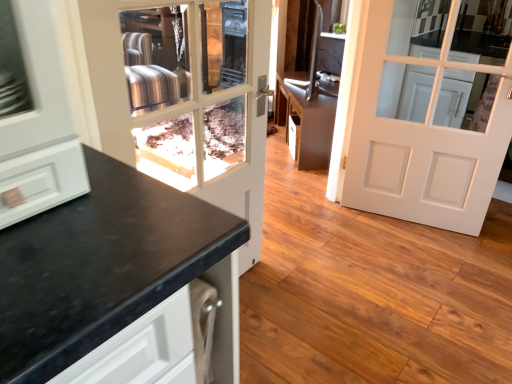
Question: Is brown matte cabinet at center to the right of white matte door at center, placed as the first door when sorted from right to left, from the viewer's perspective?

Choices:
 (A) yes
 (B) no

Answer: (B)

Question: Can we say brown matte cabinet at center lies outside white matte door at center, placed as the second door when sorted from left to right?

Choices:
 (A) yes
 (B) no

Answer: (A)

Question: From a real-world perspective, does brown matte cabinet at center sit lower than white matte door at center, placed as the first door when sorted from right to left?

Choices:
 (A) no
 (B) yes

Answer: (B)

Question: Is brown matte cabinet at center far away from white matte door at center, placed as the second door when sorted from left to right?

Choices:
 (A) yes
 (B) no

Answer: (B)

Question: Can you confirm if brown matte cabinet at center is wider than white matte door at center, placed as the first door when sorted from right to left?

Choices:
 (A) no
 (B) yes

Answer: (B)

Question: Considering the positions of matte black door at center, arranged as the first door when viewed from the left, and brown matte cabinet at center in the image, is matte black door at center, arranged as the first door when viewed from the left, taller or shorter than brown matte cabinet at center?

Choices:
 (A) tall
 (B) short

Answer: (A)

Question: Would you say matte black door at center, arranged as the first door when viewed from the left, is inside or outside brown matte cabinet at center?

Choices:
 (A) outside
 (B) inside

Answer: (A)

Question: Considering the positions of point (226, 79) and point (331, 102), is point (226, 79) closer or farther from the camera than point (331, 102)?

Choices:
 (A) farther
 (B) closer

Answer: (A)

Question: From a real-world perspective, is matte black door at center, arranged as the first door when viewed from the left, positioned above or below brown matte cabinet at center?

Choices:
 (A) above
 (B) below

Answer: (A)

Question: Is brown matte cabinet at center bigger or smaller than matte black door at center, marked as the second door in a right-to-left arrangement?

Choices:
 (A) small
 (B) big

Answer: (B)

Question: Does point (287, 84) appear closer or farther from the camera than point (176, 165)?

Choices:
 (A) farther
 (B) closer

Answer: (A)

Question: Visually, is brown matte cabinet at center positioned to the left or to the right of matte black door at center, arranged as the first door when viewed from the left?

Choices:
 (A) left
 (B) right

Answer: (B)

Question: Is brown matte cabinet at center wider or thinner than matte black door at center, marked as the second door in a right-to-left arrangement?

Choices:
 (A) wide
 (B) thin

Answer: (A)

Question: Is matte black door at center, arranged as the first door when viewed from the left, taller or shorter than white matte door at center, placed as the second door when sorted from left to right?

Choices:
 (A) short
 (B) tall

Answer: (B)

Question: Is matte black door at center, marked as the second door in a right-to-left arrangement, spatially inside white matte door at center, placed as the second door when sorted from left to right, or outside of it?

Choices:
 (A) inside
 (B) outside

Answer: (B)